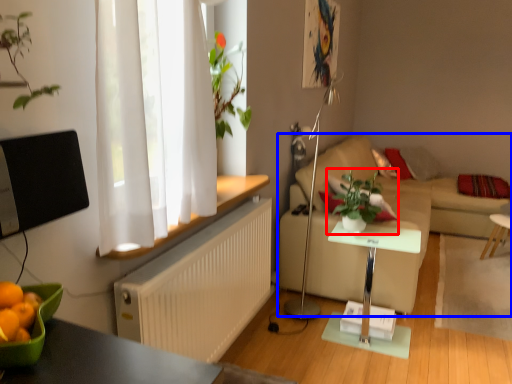
Question: Among these objects, which one is nearest to the camera, houseplant (highlighted by a red box) or studio couch (highlighted by a blue box)?

Choices:
 (A) houseplant
 (B) studio couch

Answer: (B)